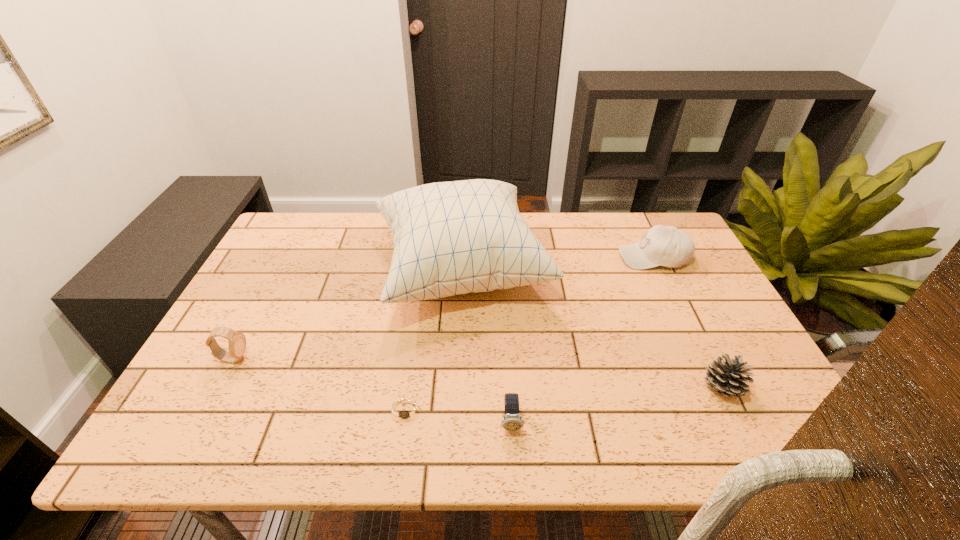
Identify the location of vacant space that's between the pinecone and the baseball cap. (688, 323).

Locate an element on the screen. free spot between the pinecone and the rightmost watch is located at coordinates (617, 405).

Locate an element on the screen. This screenshot has height=540, width=960. empty space that is in between the baseball cap and the leftmost object is located at coordinates (444, 308).

Image resolution: width=960 pixels, height=540 pixels. I want to click on free point between the cushion and the second watch from left to right, so click(434, 340).

At what (x,y) coordinates should I click in order to perform the action: click on free spot between the tallest object and the third farthest object. Please return your answer as a coordinate pair (x, y). The image size is (960, 540). Looking at the image, I should click on (347, 315).

The image size is (960, 540). I want to click on vacant area that lies between the leftmost object and the shortest watch, so click(x=320, y=384).

The width and height of the screenshot is (960, 540). I want to click on unoccupied area between the pinecone and the leftmost object, so click(477, 374).

What are the coordinates of `the second closest object to the baseball cap` in the screenshot? It's located at (729, 378).

Locate which object ranks in proximity to the tallest object. Please provide its 2D coordinates. Your answer should be formatted as a tuple, i.e. [(x, y)], where the tuple contains the x and y coordinates of a point satisfying the conditions above.

[(407, 410)]

The width and height of the screenshot is (960, 540). Identify the location of watch that is the third closest to the baseball cap. (237, 341).